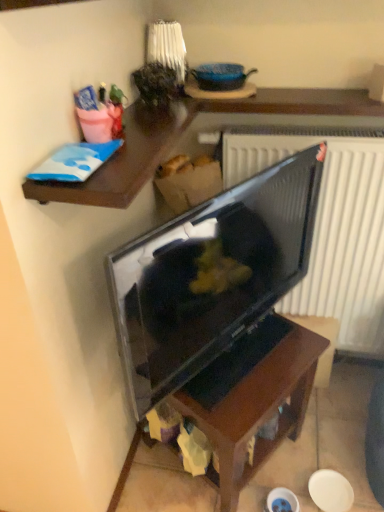
Question: Is matte black tv at center located within dark wood table at center?

Choices:
 (A) yes
 (B) no

Answer: (B)

Question: From a real-world perspective, is dark wood table at center below matte black tv at center?

Choices:
 (A) no
 (B) yes

Answer: (B)

Question: Can we say dark wood table at center lies outside matte black tv at center?

Choices:
 (A) yes
 (B) no

Answer: (A)

Question: Is there a large distance between dark wood table at center and matte black tv at center?

Choices:
 (A) yes
 (B) no

Answer: (B)

Question: From a real-world perspective, is dark wood table at center on top of matte black tv at center?

Choices:
 (A) yes
 (B) no

Answer: (B)

Question: Can you confirm if dark wood table at center is positioned to the left of matte black tv at center?

Choices:
 (A) no
 (B) yes

Answer: (A)

Question: From the image's perspective, is matte black tv at center below dark wood table at center?

Choices:
 (A) no
 (B) yes

Answer: (A)

Question: Considering the relative sizes of matte black tv at center and dark wood table at center in the image provided, is matte black tv at center smaller than dark wood table at center?

Choices:
 (A) no
 (B) yes

Answer: (B)

Question: Does matte black tv at center have a lesser height compared to dark wood table at center?

Choices:
 (A) no
 (B) yes

Answer: (A)

Question: Does matte black tv at center have a lesser width compared to dark wood table at center?

Choices:
 (A) yes
 (B) no

Answer: (A)

Question: Would you say matte black tv at center contains dark wood table at center?

Choices:
 (A) no
 (B) yes

Answer: (A)

Question: Can you confirm if matte black tv at center is bigger than dark wood table at center?

Choices:
 (A) no
 (B) yes

Answer: (A)

Question: Is wooden shelf at upper left in front of dark wood table at center?

Choices:
 (A) no
 (B) yes

Answer: (B)